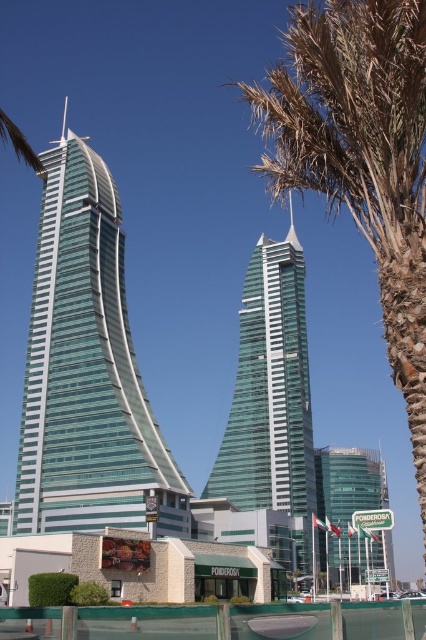
Is translucent glass skyscraper at center taller than transparent glass tower at center?

Correct, translucent glass skyscraper at center is much taller as transparent glass tower at center.

Can you confirm if translucent glass skyscraper at center is positioned to the right of transparent glass tower at center?

No, translucent glass skyscraper at center is not to the right of transparent glass tower at center.

Is point (115, 442) positioned in front of point (244, 403)?

Yes.

Where is `translucent glass skyscraper at center`? translucent glass skyscraper at center is located at coordinates (86, 369).

Which is below, translucent glass skyscraper at center or green glass building at center?

green glass building at center

Does translucent glass skyscraper at center have a lesser height compared to green glass building at center?

No.

Locate an element on the screen. This screenshot has height=640, width=426. translucent glass skyscraper at center is located at coordinates (86, 369).

From the picture: How distant is green leafy palm tree at upper right from green glass building at center?

green leafy palm tree at upper right and green glass building at center are 179.90 feet apart from each other.

Is green leafy palm tree at upper right to the left of green glass building at center from the viewer's perspective?

Yes, green leafy palm tree at upper right is to the left of green glass building at center.

Is point (271, 72) in front of point (331, 552)?

That is True.

Image resolution: width=426 pixels, height=640 pixels. I want to click on green leafy palm tree at upper right, so point(360,156).